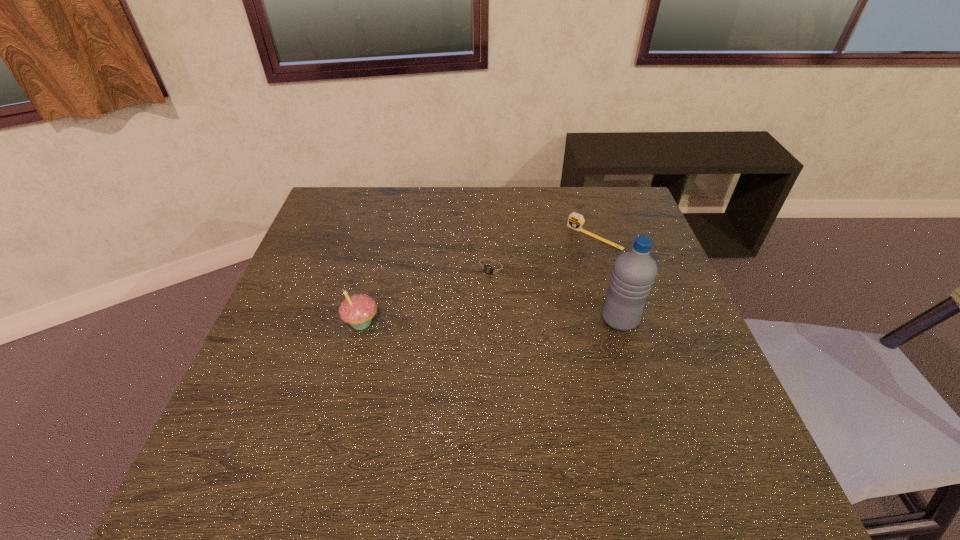
The height and width of the screenshot is (540, 960). What are the coordinates of `vacant area situated 0.210m at the front of the third tallest object with the tape extended` in the screenshot? It's located at (539, 287).

Locate an element on the screen. Image resolution: width=960 pixels, height=540 pixels. free region located at the front of the third tallest object with the tape extended is located at coordinates (562, 265).

The image size is (960, 540). What are the coordinates of `blank area located 0.280m on the face of the watch` in the screenshot? It's located at (423, 361).

You are a GUI agent. You are given a task and a screenshot of the screen. Output one action in this format:
    pyautogui.click(x=<x>, y=<y>)
    Task: Click on the vacant area located 0.150m on the face of the watch
    The width and height of the screenshot is (960, 540).
    Given the screenshot: What is the action you would take?
    pyautogui.click(x=453, y=321)

Where is `free region located 0.160m on the face of the watch`? The width and height of the screenshot is (960, 540). free region located 0.160m on the face of the watch is located at coordinates (451, 324).

At what (x,y) coordinates should I click in order to perform the action: click on object that is at the far edge. Please return your answer as a coordinate pair (x, y). Image resolution: width=960 pixels, height=540 pixels. Looking at the image, I should click on (575, 221).

You are a GUI agent. You are given a task and a screenshot of the screen. Output one action in this format:
    pyautogui.click(x=<x>, y=<y>)
    Task: Click on the water bottle located at the right edge
    
    Given the screenshot: What is the action you would take?
    pyautogui.click(x=634, y=272)

Locate an element on the screen. The height and width of the screenshot is (540, 960). tape measure at the right edge is located at coordinates (575, 221).

Where is `object located in the far right corner section of the desktop`? object located in the far right corner section of the desktop is located at coordinates (575, 221).

This screenshot has height=540, width=960. Identify the location of free space at the far edge. (447, 199).